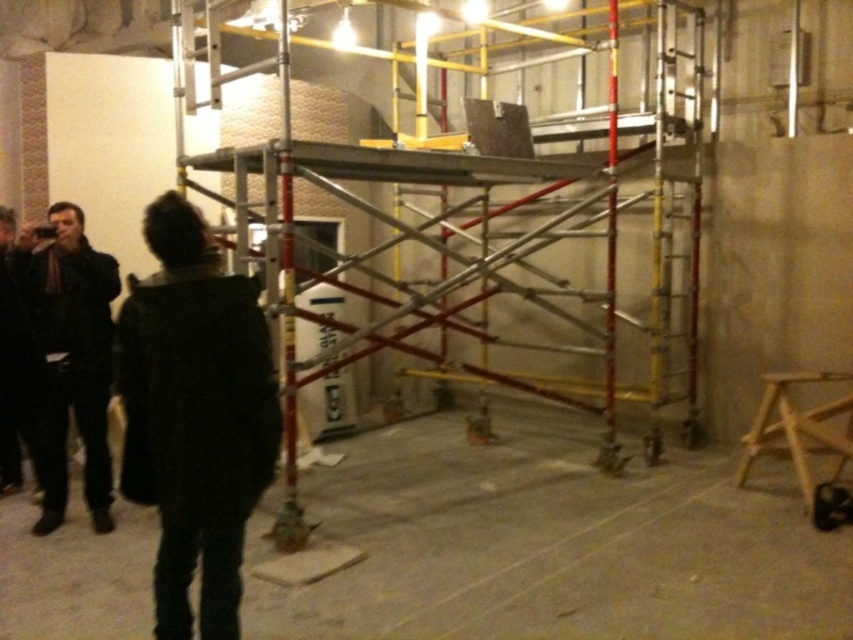
Question: Which point is closer to the camera?

Choices:
 (A) dark brown leather jacket at left
 (B) dark green jacket at left

Answer: (B)

Question: Among these points, which one is nearest to the camera?

Choices:
 (A) (76, 208)
 (B) (132, 392)

Answer: (B)

Question: Is dark green jacket at left to the right of dark brown leather jacket at left from the viewer's perspective?

Choices:
 (A) no
 (B) yes

Answer: (B)

Question: Does concrete floor at center appear on the left side of dark brown leather jacket at left?

Choices:
 (A) no
 (B) yes

Answer: (A)

Question: Is the position of dark green jacket at left less distant than that of dark brown leather jacket at left?

Choices:
 (A) no
 (B) yes

Answer: (B)

Question: Which of the following is the farthest from the observer?

Choices:
 (A) dark brown leather jacket at left
 (B) concrete floor at center
 (C) dark green jacket at left

Answer: (A)